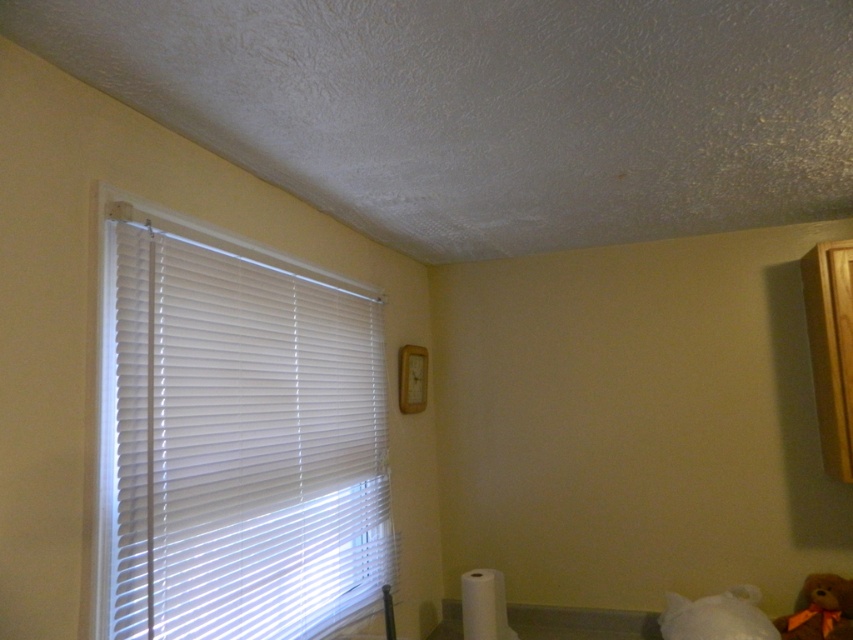
Question: Which point is farther to the camera?

Choices:
 (A) brown plush teddy bear at lower right
 (B) white plastic blinds at left

Answer: (A)

Question: Which object is farther from the camera taking this photo?

Choices:
 (A) brown plush teddy bear at lower right
 (B) white plastic blinds at left

Answer: (A)

Question: Is the position of white plastic blinds at left more distant than that of brown plush teddy bear at lower right?

Choices:
 (A) no
 (B) yes

Answer: (A)

Question: Is white plastic blinds at left positioned in front of brown plush teddy bear at lower right?

Choices:
 (A) yes
 (B) no

Answer: (A)

Question: Which point is closer to the camera taking this photo?

Choices:
 (A) (378, 291)
 (B) (809, 598)

Answer: (B)

Question: Is white plastic blinds at left wider than brown plush teddy bear at lower right?

Choices:
 (A) yes
 (B) no

Answer: (A)